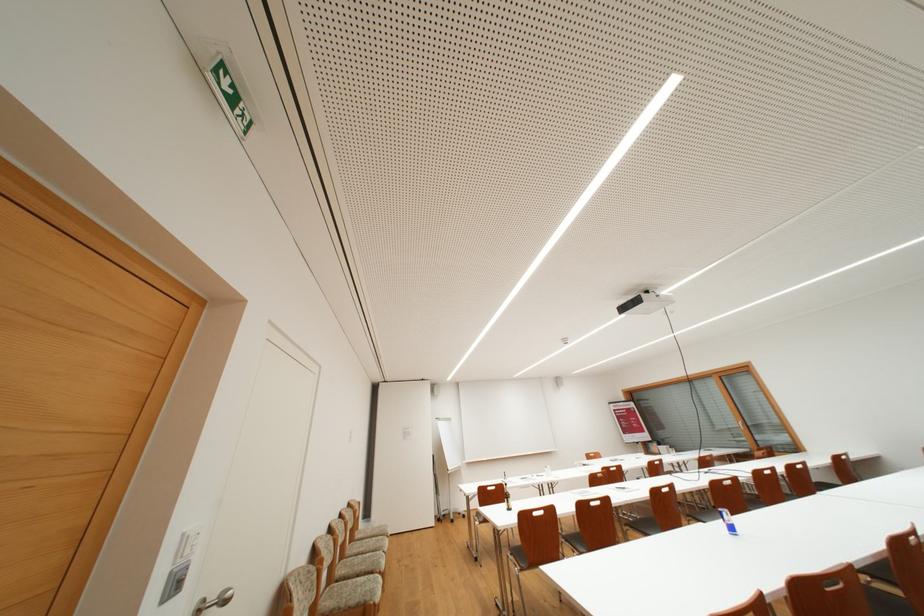
Which object does [506,499] point to?

It refers to a brown glass bottle.